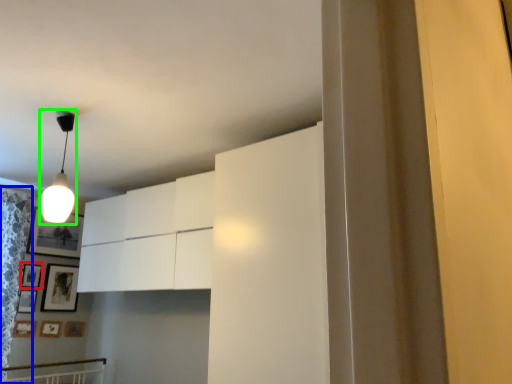
Question: Which object is the farthest from picture frame (highlighted by a red box)? Choose among these: curtain (highlighted by a blue box) or lamp (highlighted by a green box).

Choices:
 (A) curtain
 (B) lamp

Answer: (B)